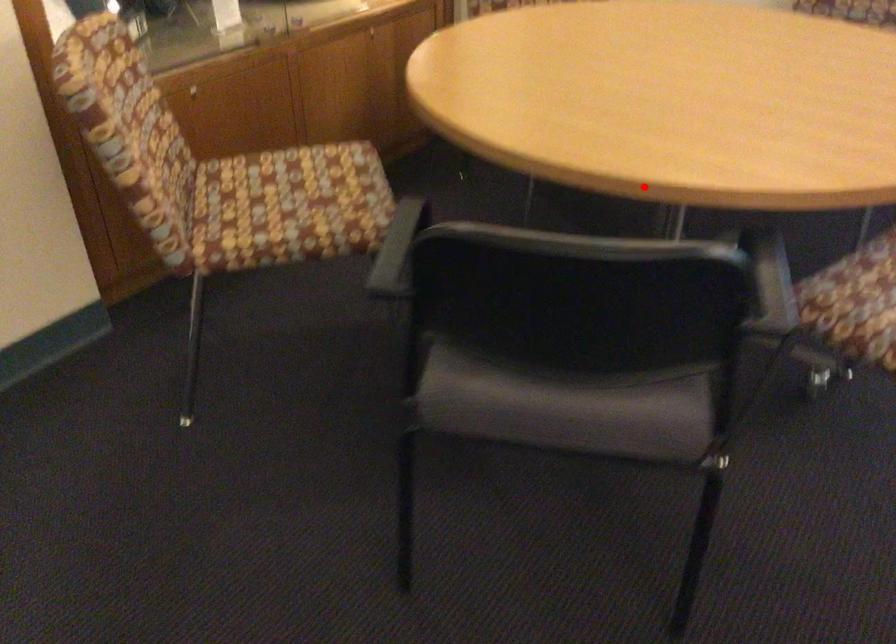
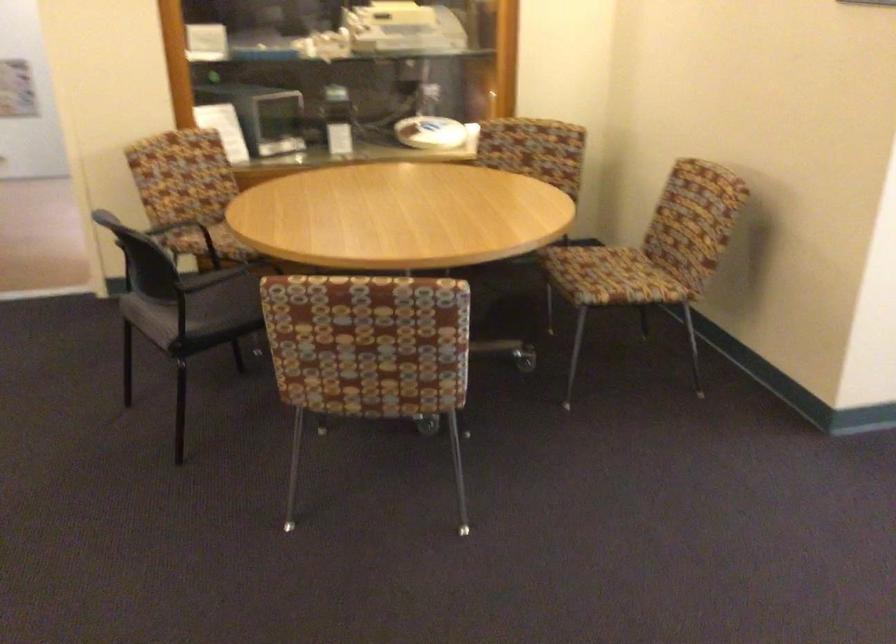
Question: I am providing you with two images of the same scene from different viewpoints. In image1, a red point is highlighted. Considering the same 3D point in image2, which of the following is correct?

Choices:
 (A) It is closer
 (B) It is farther

Answer: (B)